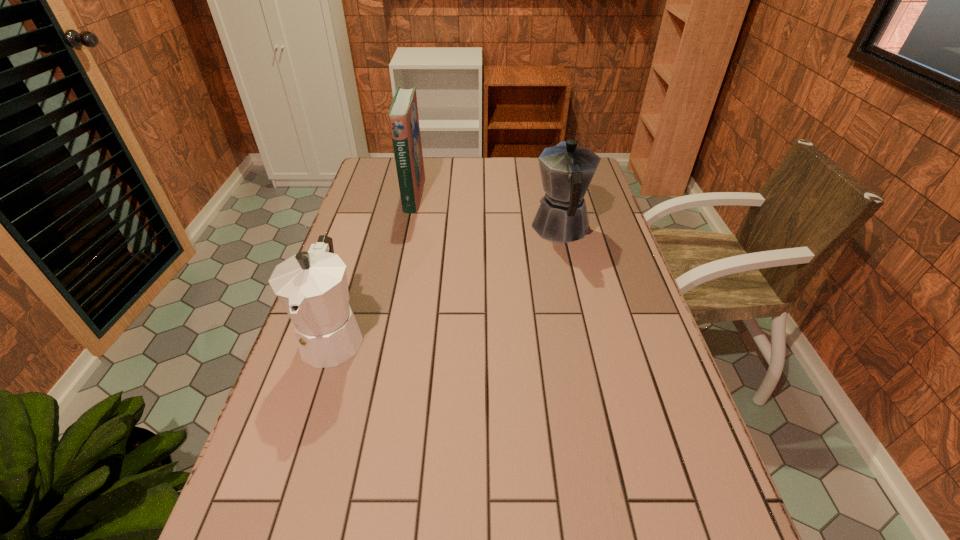
The height and width of the screenshot is (540, 960). I want to click on hardback book, so coord(403,115).

Find the location of a particular element. The image size is (960, 540). the rightmost object is located at coordinates (566, 169).

Locate an element on the screen. This screenshot has width=960, height=540. the farther coffeepot is located at coordinates (566, 169).

This screenshot has height=540, width=960. I want to click on the leftmost object, so click(x=312, y=286).

You are a GUI agent. You are given a task and a screenshot of the screen. Output one action in this format:
    pyautogui.click(x=<x>, y=<y>)
    Task: Click on the left coffeepot
    Image resolution: width=960 pixels, height=540 pixels.
    Given the screenshot: What is the action you would take?
    pyautogui.click(x=312, y=286)

You are a GUI agent. You are given a task and a screenshot of the screen. Output one action in this format:
    pyautogui.click(x=<x>, y=<y>)
    Task: Click on the vacant region located 0.220m on the cover of the hardback book
    
    Given the screenshot: What is the action you would take?
    pyautogui.click(x=483, y=194)

The width and height of the screenshot is (960, 540). Identify the location of free space located at the spout of the rightmost object. (550, 181).

The height and width of the screenshot is (540, 960). In order to click on vacant space located at the spout of the rightmost object in this screenshot , I will do `click(549, 178)`.

This screenshot has width=960, height=540. Identify the location of vacant space located 0.320m at the spout of the rightmost object. (545, 163).

Find the location of a particular element. Image resolution: width=960 pixels, height=540 pixels. blank space located 0.190m at the spout of the left coffeepot is located at coordinates (294, 461).